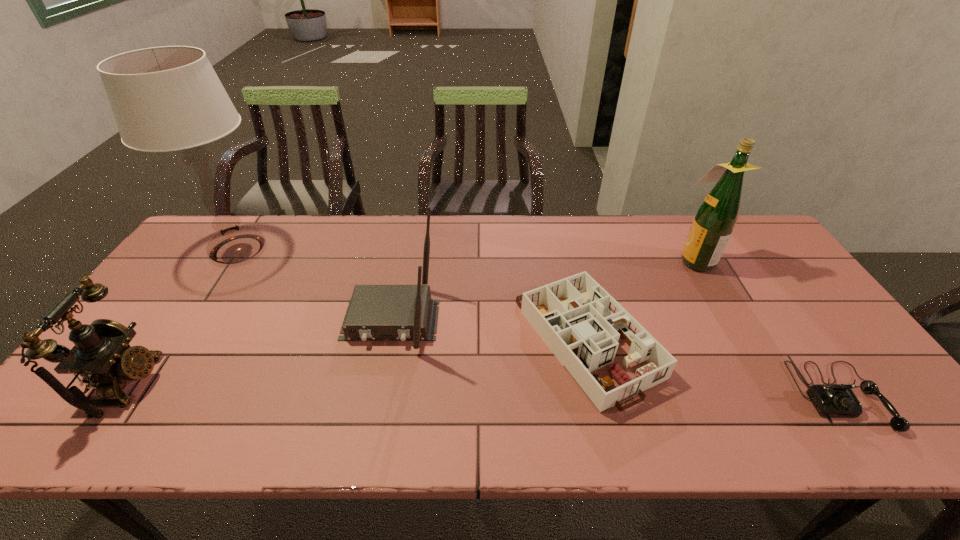
Find the location of a particular element. Image resolution: width=960 pixels, height=540 pixels. the tallest object is located at coordinates (169, 98).

At what (x,y) coordinates should I click in order to perform the action: click on the fifth shortest object. Please return your answer as a coordinate pair (x, y). This screenshot has width=960, height=540. Looking at the image, I should click on (715, 219).

This screenshot has width=960, height=540. What are the coordinates of `liquor` in the screenshot? It's located at (715, 219).

At what (x,y) coordinates should I click in order to perform the action: click on router. Please return your answer as a coordinate pair (x, y). Looking at the image, I should click on (400, 312).

I want to click on the taller telephone, so click(x=101, y=354).

What are the coordinates of `the fourth object from left to right` in the screenshot? It's located at (584, 338).

Find the location of a particular element. This screenshot has width=960, height=540. the shorter telephone is located at coordinates (831, 400).

This screenshot has height=540, width=960. In order to click on the rightmost object in this screenshot , I will do `click(831, 400)`.

You are a GUI agent. You are given a task and a screenshot of the screen. Output one action in this format:
    pyautogui.click(x=<x>, y=<y>)
    Task: Click on the vacant space located 0.200m on the front-facing side of the table lamp
    
    Given the screenshot: What is the action you would take?
    pyautogui.click(x=187, y=330)

The width and height of the screenshot is (960, 540). I want to click on vacant position located on the front-facing side of the fifth object from left to right, so click(x=578, y=260).